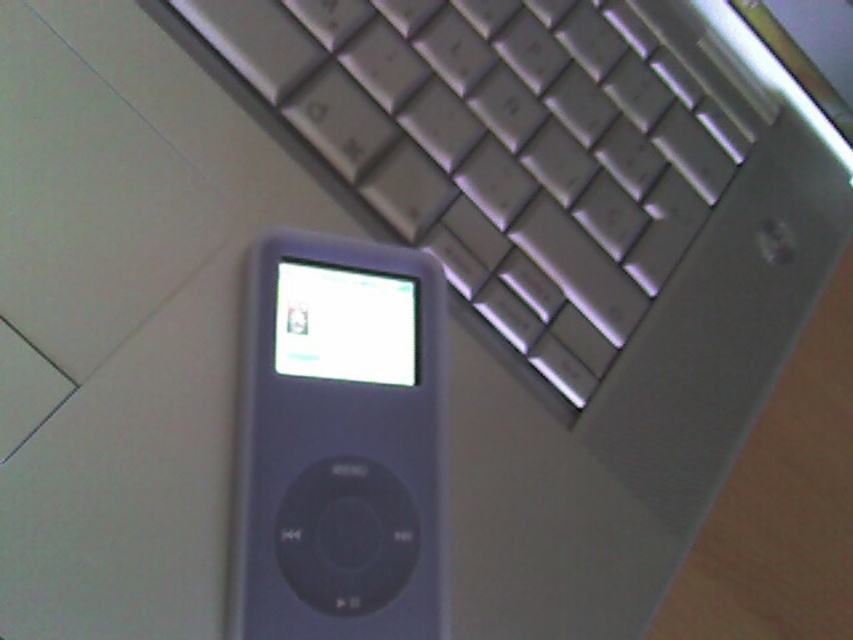
Can you confirm if satin silver keyboard at center is bigger than slate gray plastic ipod at center?

Correct, satin silver keyboard at center is larger in size than slate gray plastic ipod at center.

Looking at this image, does satin silver keyboard at center have a lesser width compared to slate gray plastic ipod at center?

No.

The width and height of the screenshot is (853, 640). What do you see at coordinates (505, 148) in the screenshot?
I see `satin silver keyboard at center` at bounding box center [505, 148].

Where is `satin silver keyboard at center`? satin silver keyboard at center is located at coordinates coord(505,148).